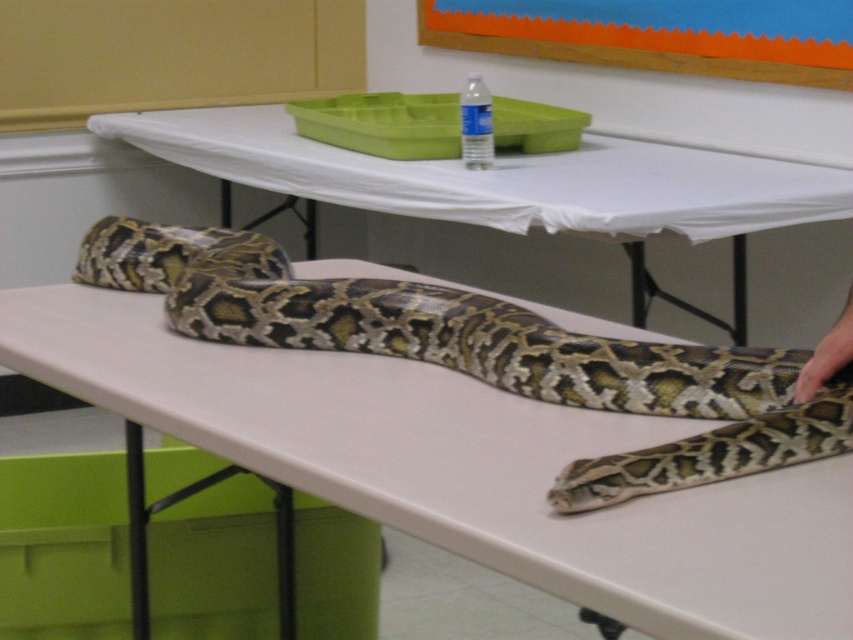
Question: Is patterned scales snake at center smaller than orange matte bulletin board at upper center?

Choices:
 (A) yes
 (B) no

Answer: (A)

Question: Which point is closer to the camera?

Choices:
 (A) smooth white table at center
 (B) patterned scales snake at center

Answer: (B)

Question: Which point appears farthest from the camera in this image?

Choices:
 (A) (517, 348)
 (B) (679, 227)
 (C) (759, 65)

Answer: (C)

Question: Can you confirm if patterned scales snake at center is positioned to the left of orange matte bulletin board at upper center?

Choices:
 (A) no
 (B) yes

Answer: (B)

Question: Which object is the closest to the orange matte bulletin board at upper center?

Choices:
 (A) patterned scales snake at center
 (B) smooth white table at center

Answer: (B)

Question: Is smooth white table at center smaller than orange matte bulletin board at upper center?

Choices:
 (A) no
 (B) yes

Answer: (A)